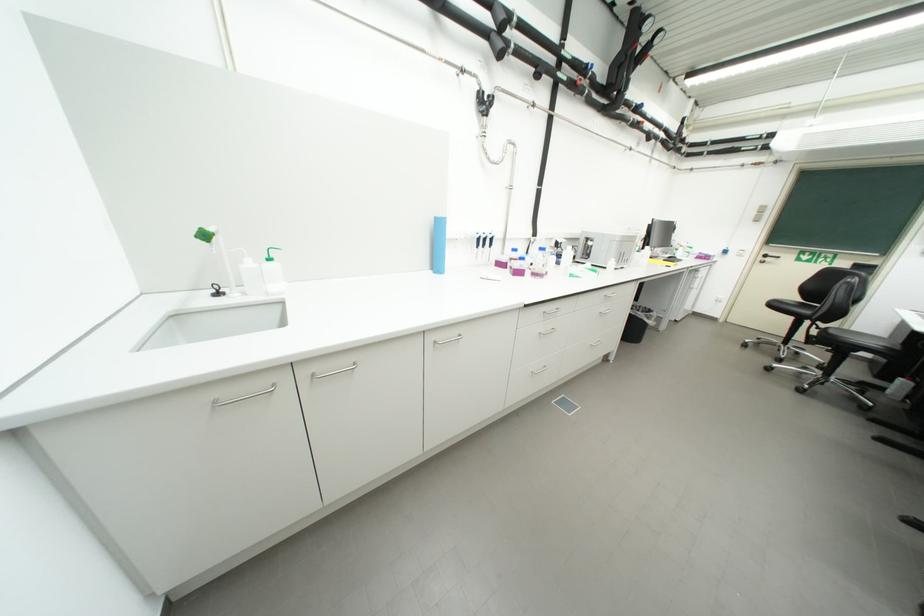
Identify the location of chair sitting surface. (796, 308).